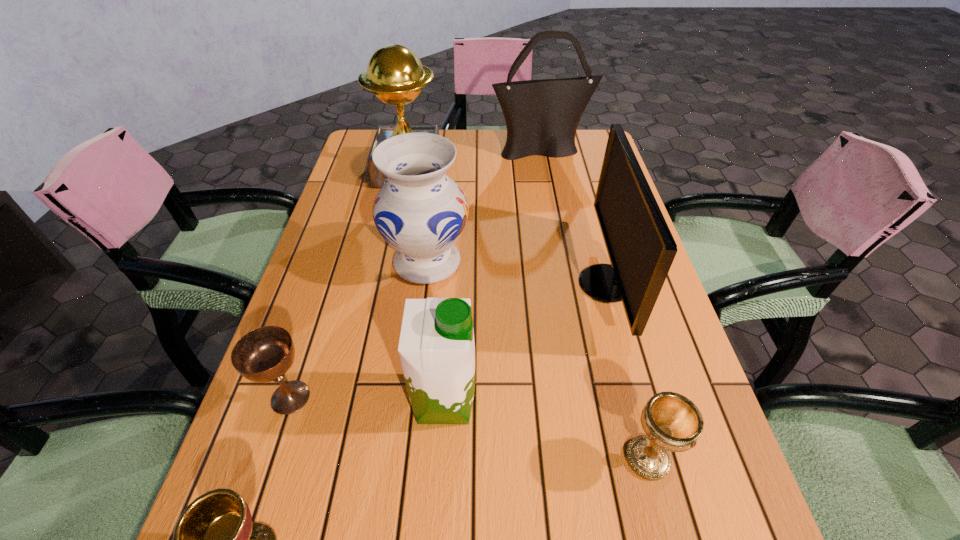
The height and width of the screenshot is (540, 960). Identify the location of vacant area situated 0.310m on the front of the vase. (408, 424).

At what (x,y) coordinates should I click in order to perform the action: click on vacant space located on the front-facing side of the computer monitor. Please return your answer as a coordinate pair (x, y). This screenshot has width=960, height=540. Looking at the image, I should click on (496, 284).

Locate an element on the screen. free region located on the front-facing side of the computer monitor is located at coordinates (431, 284).

Find the location of a particular element. The width and height of the screenshot is (960, 540). free space located 0.110m on the front-facing side of the computer monitor is located at coordinates (531, 284).

Find the location of a particular element. vacant space situated 0.070m on the front-facing side of the soya milk is located at coordinates (514, 401).

You are a GUI agent. You are given a task and a screenshot of the screen. Output one action in this format:
    pyautogui.click(x=<x>, y=<y>)
    Task: Click on the vacant position located 0.100m on the right of the farthest chalice
    The width and height of the screenshot is (960, 540).
    Given the screenshot: What is the action you would take?
    pyautogui.click(x=370, y=397)

Where is `vacant space located on the left of the second nearest object`? The image size is (960, 540). vacant space located on the left of the second nearest object is located at coordinates (474, 458).

In order to click on award located at the far edge in this screenshot , I will do `click(395, 74)`.

Identify the location of shoulder bag that is positioned at the far edge. (542, 116).

Locate an element on the screen. The width and height of the screenshot is (960, 540). award at the left edge is located at coordinates (395, 74).